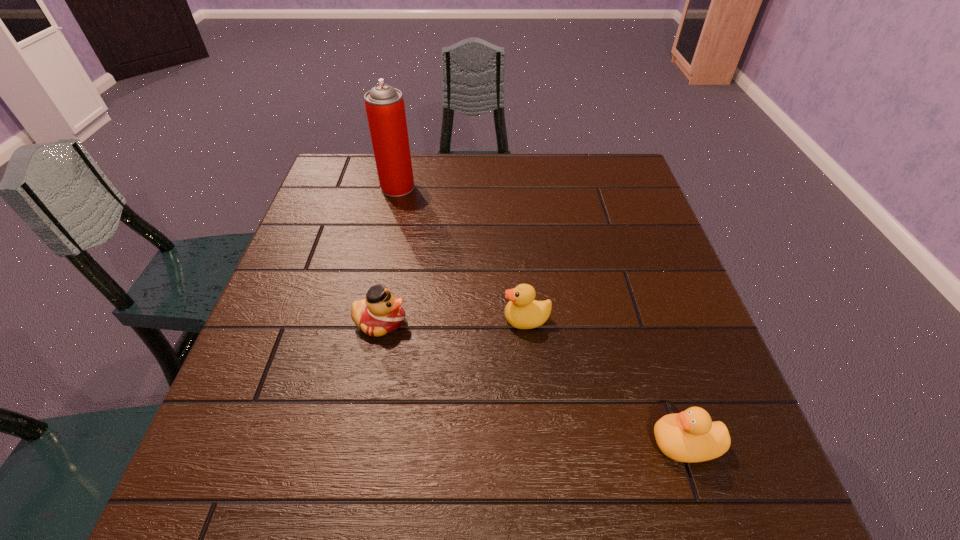
You are a GUI agent. You are given a task and a screenshot of the screen. Output one action in this format:
    pyautogui.click(x=<x>, y=<y>)
    Task: Click on the free space located at the beak of the second duck from left to right
    
    Given the screenshot: What is the action you would take?
    pyautogui.click(x=457, y=319)

This screenshot has width=960, height=540. I want to click on vacant space located 0.380m on the face of the rightmost duck, so click(x=429, y=443).

Where is `vacant space positioned on the face of the rightmost duck`? This screenshot has height=540, width=960. vacant space positioned on the face of the rightmost duck is located at coordinates (576, 443).

This screenshot has height=540, width=960. Identify the location of free point located on the face of the rightmost duck. (436, 443).

Where is `object situated at the far edge`? The width and height of the screenshot is (960, 540). object situated at the far edge is located at coordinates (385, 109).

Locate an element on the screen. This screenshot has width=960, height=540. object located in the near edge section of the desktop is located at coordinates 690,436.

At what (x,y) coordinates should I click in order to perform the action: click on object at the right edge. Please return your answer as a coordinate pair (x, y). The width and height of the screenshot is (960, 540). Looking at the image, I should click on (690, 436).

In order to click on object located in the near right corner section of the desktop in this screenshot , I will do `click(690, 436)`.

Locate an element on the screen. vacant space at the far edge of the desktop is located at coordinates (558, 170).

The height and width of the screenshot is (540, 960). I want to click on free space at the near edge of the desktop, so click(380, 512).